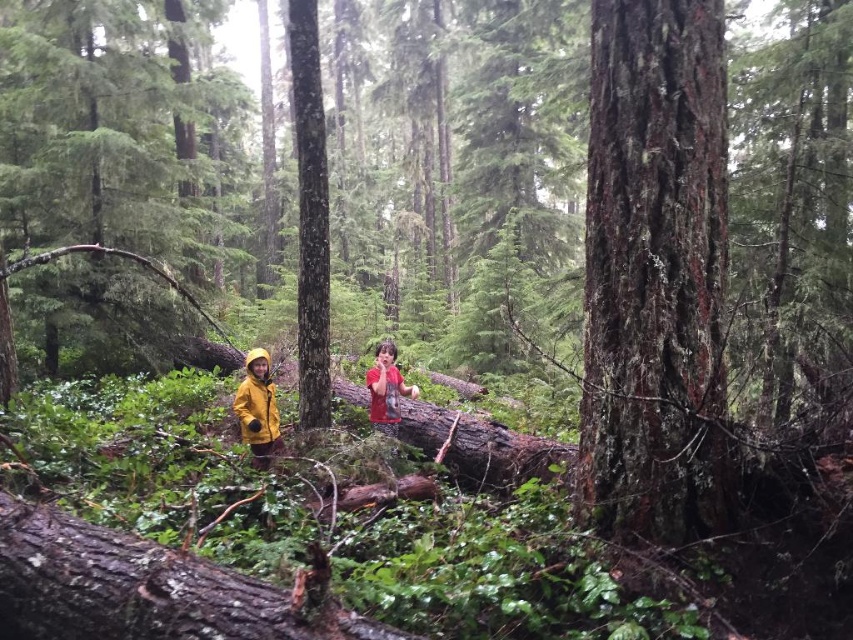
Question: Which object is positioned farthest from the smooth bark tree at center?

Choices:
 (A) red matte shirt at center
 (B) smooth dark brown tree trunk at center
 (C) yellow matte raincoat at lower left

Answer: (B)

Question: Does smooth bark tree at center have a lesser width compared to yellow matte raincoat at lower left?

Choices:
 (A) yes
 (B) no

Answer: (B)

Question: Which point is farther from the camera taking this photo?

Choices:
 (A) (380, 428)
 (B) (303, 64)

Answer: (A)

Question: Can you confirm if smooth dark brown tree trunk at center is smaller than red matte shirt at center?

Choices:
 (A) no
 (B) yes

Answer: (A)

Question: Is smooth bark tree at center bigger than red matte shirt at center?

Choices:
 (A) yes
 (B) no

Answer: (A)

Question: Among these points, which one is nearest to the camera?

Choices:
 (A) (314, 122)
 (B) (381, 417)
 (C) (247, 355)
 (D) (598, 381)

Answer: (D)